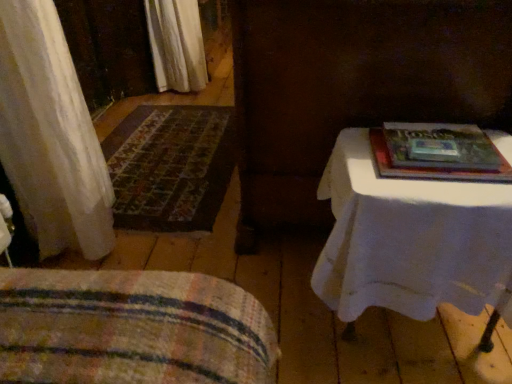
Where is `free space above white cloth-covered table at right (from a real-world perspective)`? free space above white cloth-covered table at right (from a real-world perspective) is located at coordinates tap(412, 175).